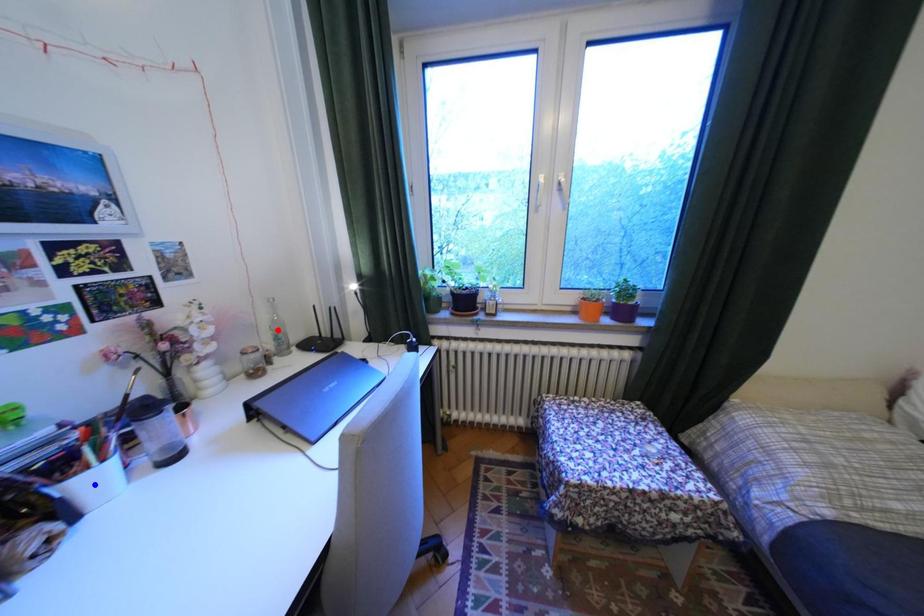
Question: In the image, two points are highlighted. Which point is nearer to the camera? Reply with the corresponding letter.

Choices:
 (A) blue point
 (B) red point

Answer: (A)